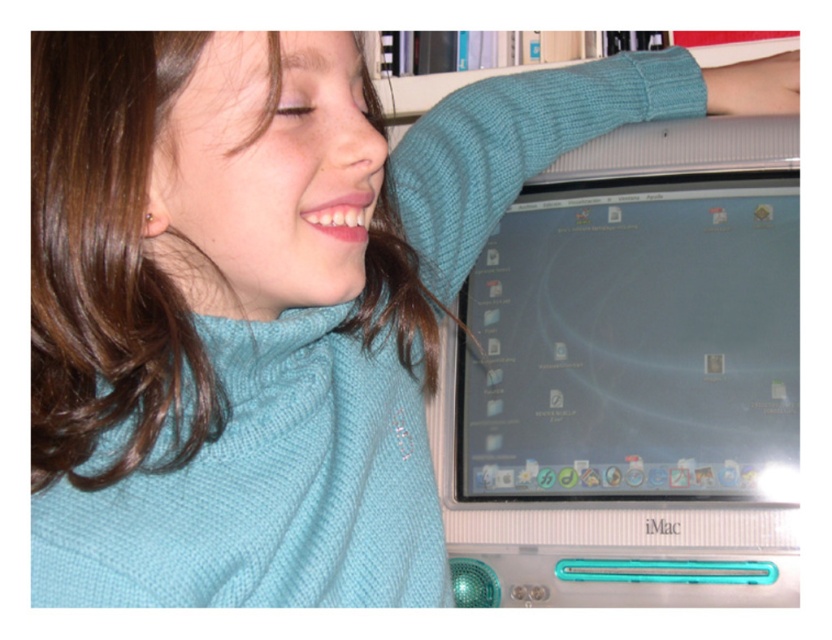
Question: Which point is farther to the camera?

Choices:
 (A) (x=675, y=182)
 (B) (x=565, y=64)
 (C) (x=724, y=108)

Answer: (B)

Question: Can you confirm if satin silver monitor at center is smaller than teal knitted sleeve at upper right?

Choices:
 (A) yes
 (B) no

Answer: (B)

Question: Does satin silver monitor at center appear over white paperbacks at upper center?

Choices:
 (A) yes
 (B) no

Answer: (B)

Question: Which point appears farthest from the camera in this image?

Choices:
 (A) (577, 412)
 (B) (390, 115)
 (C) (704, 67)

Answer: (B)

Question: Can you confirm if satin silver monitor at center is positioned below teal knitted sleeve at upper right?

Choices:
 (A) yes
 (B) no

Answer: (A)

Question: Which object is farther from the camera taking this photo?

Choices:
 (A) satin silver monitor at center
 (B) white paperbacks at upper center
 (C) teal knitted sleeve at upper right

Answer: (B)